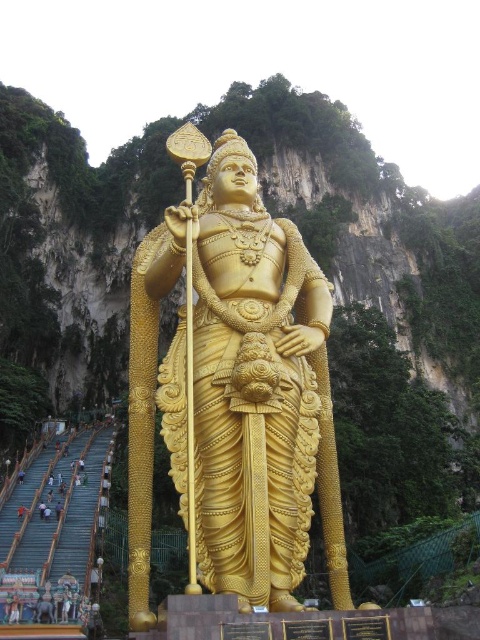
You are an art conservator assessing the space around the gold polished statue at center and the light brown skin at lower left. Which object takes up more horizontal space?

The gold polished statue at center is wider than the light brown skin at lower left, so it takes up more horizontal space.